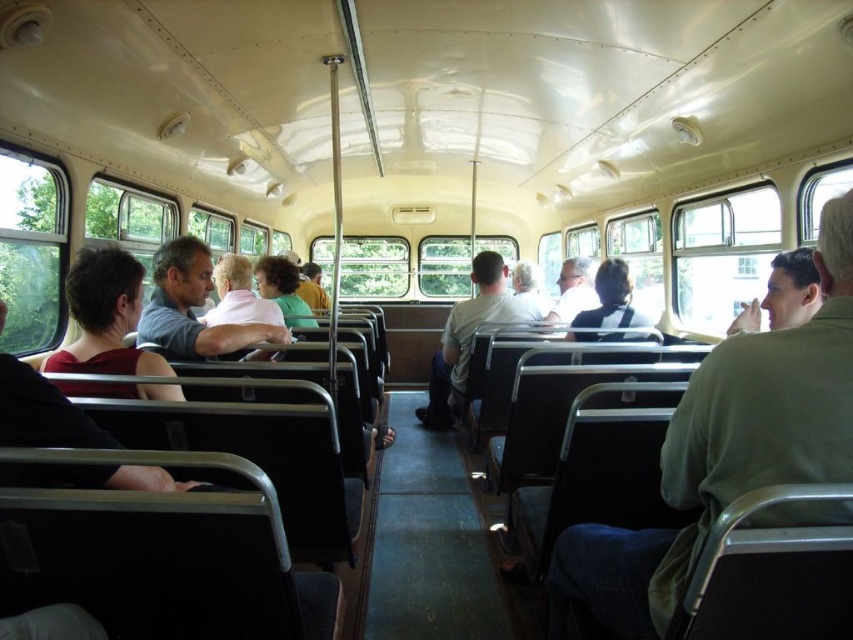
You are a passenger on the bus and need to reach the matte gray shirt at center. From your current position, which direction should you move to get closer to it?

The matte gray shirt at center is located at point [192,307], so you should move towards the center of the bus to reach it.